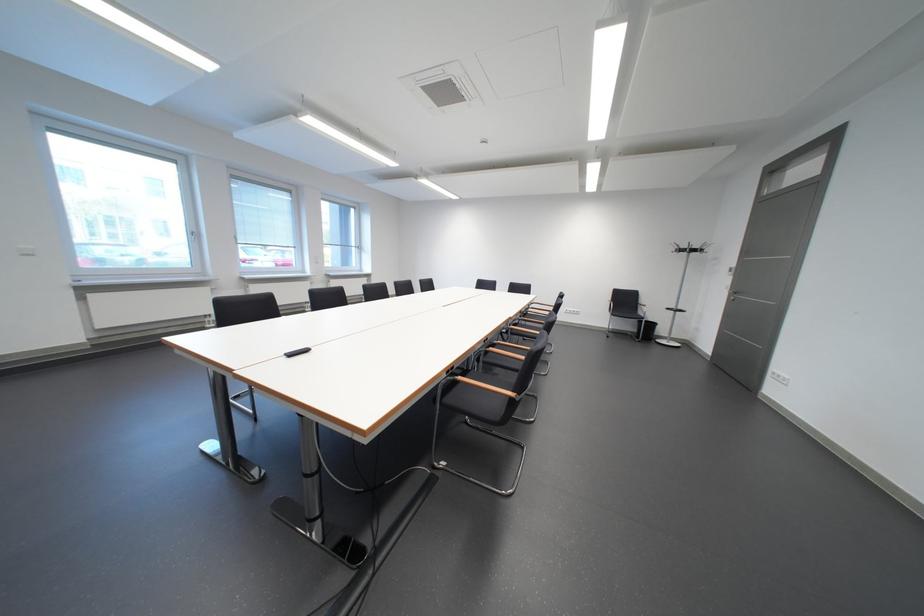
Identify the location of chair armrest. The height and width of the screenshot is (616, 924). (612, 302).